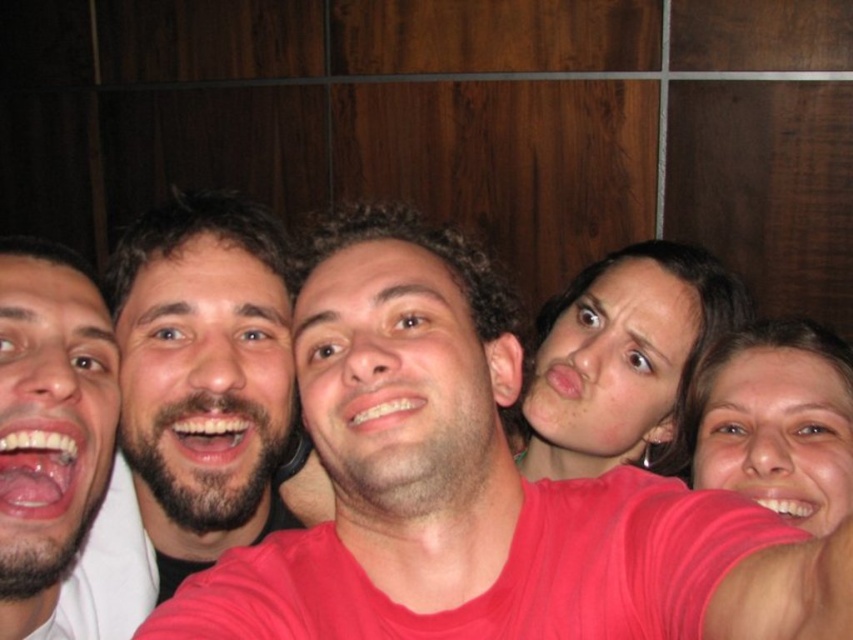
Which is more to the left, pink fabric shirt at center or smooth skin face at center?

pink fabric shirt at center is more to the left.

This screenshot has width=853, height=640. What are the coordinates of `pink fabric shirt at center` in the screenshot? It's located at (480, 486).